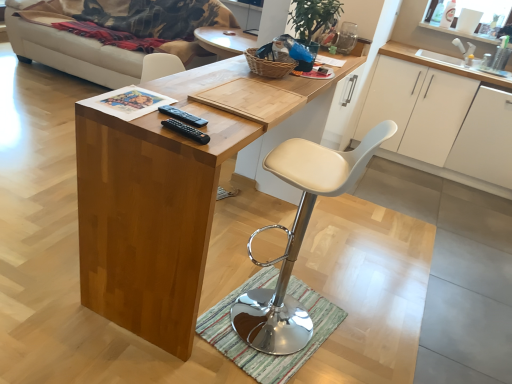
Question: Does white matte cabinet at upper right, which is the second cabinetry in right-to-left order, have a lesser height compared to beige fabric couch at upper left?

Choices:
 (A) no
 (B) yes

Answer: (B)

Question: Is white matte cabinet at upper right, acting as the first cabinetry starting from the left, further to camera compared to beige fabric couch at upper left?

Choices:
 (A) no
 (B) yes

Answer: (A)

Question: Is white matte cabinet at upper right, acting as the first cabinetry starting from the left, thinner than beige fabric couch at upper left?

Choices:
 (A) no
 (B) yes

Answer: (B)

Question: Is beige fabric couch at upper left surrounded by white matte cabinet at upper right, which is the second cabinetry in right-to-left order?

Choices:
 (A) no
 (B) yes

Answer: (A)

Question: From a real-world perspective, is white matte cabinet at upper right, which is the second cabinetry in right-to-left order, located higher than beige fabric couch at upper left?

Choices:
 (A) no
 (B) yes

Answer: (A)

Question: Considering the relative positions of white matte cabinet at upper right, acting as the first cabinetry starting from the left, and beige fabric couch at upper left in the image provided, is white matte cabinet at upper right, acting as the first cabinetry starting from the left, to the right of beige fabric couch at upper left from the viewer's perspective?

Choices:
 (A) yes
 (B) no

Answer: (A)

Question: Is wooden desk at center smaller than black plastic remote at center?

Choices:
 (A) yes
 (B) no

Answer: (B)

Question: From the image's perspective, is wooden desk at center over black plastic remote at center?

Choices:
 (A) yes
 (B) no

Answer: (B)

Question: Does wooden desk at center have a greater height compared to black plastic remote at center?

Choices:
 (A) no
 (B) yes

Answer: (B)

Question: Is wooden desk at center bigger than black plastic remote at center?

Choices:
 (A) yes
 (B) no

Answer: (A)

Question: Is wooden desk at center oriented towards black plastic remote at center?

Choices:
 (A) yes
 (B) no

Answer: (B)

Question: Would you consider wooden desk at center to be distant from black plastic remote at center?

Choices:
 (A) yes
 (B) no

Answer: (B)

Question: From a real-world perspective, is white leather stool at center physically below white matte cabinet at right, marked as the first cabinetry in a right-to-left arrangement?

Choices:
 (A) no
 (B) yes

Answer: (A)